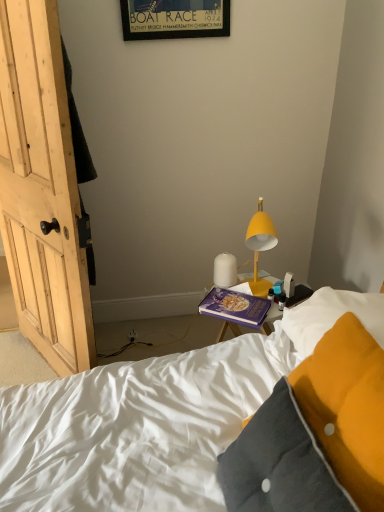
Question: Considering the positions of wooden framed poster at upper center and velvet yellow pillow at lower right in the image, is wooden framed poster at upper center taller or shorter than velvet yellow pillow at lower right?

Choices:
 (A) short
 (B) tall

Answer: (A)

Question: From a real-world perspective, relative to velvet yellow pillow at lower right, is wooden framed poster at upper center vertically above or below?

Choices:
 (A) above
 (B) below

Answer: (A)

Question: Estimate the real-world distances between objects in this image. Which object is closer to the purple matte book at center?

Choices:
 (A) wooden framed poster at upper center
 (B) velvet yellow pillow at lower right
 (C) white matte lamp at center, marked as the 1th lamp in a left-to-right arrangement
 (D) yellow matte lamp at upper right, arranged as the first lamp when viewed from the right

Answer: (C)

Question: Which object is the farthest from the wooden framed poster at upper center?

Choices:
 (A) white matte lamp at center, which is counted as the 2th lamp, starting from the right
 (B) yellow matte lamp at upper right, arranged as the 2th lamp when viewed from the left
 (C) velvet yellow pillow at lower right
 (D) purple matte book at center

Answer: (C)